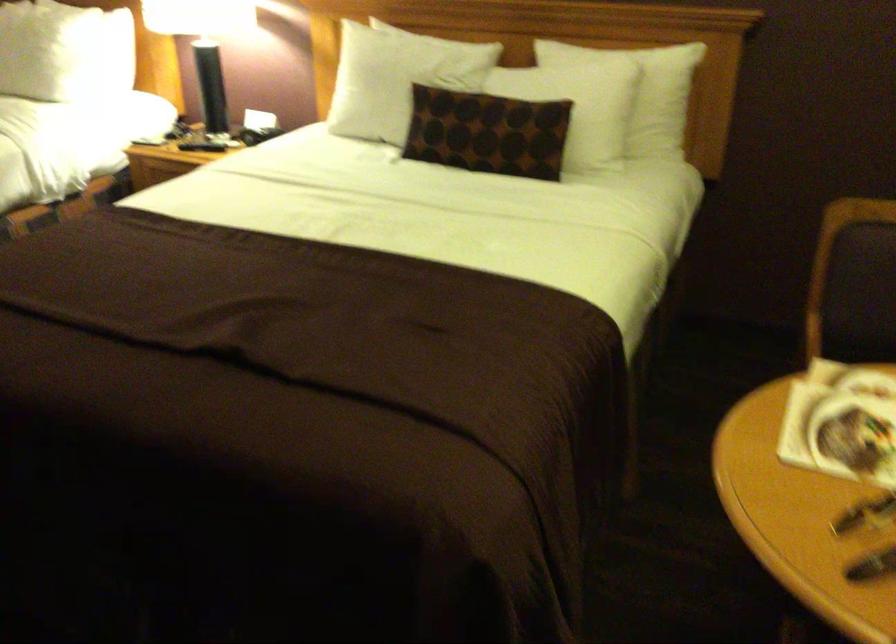
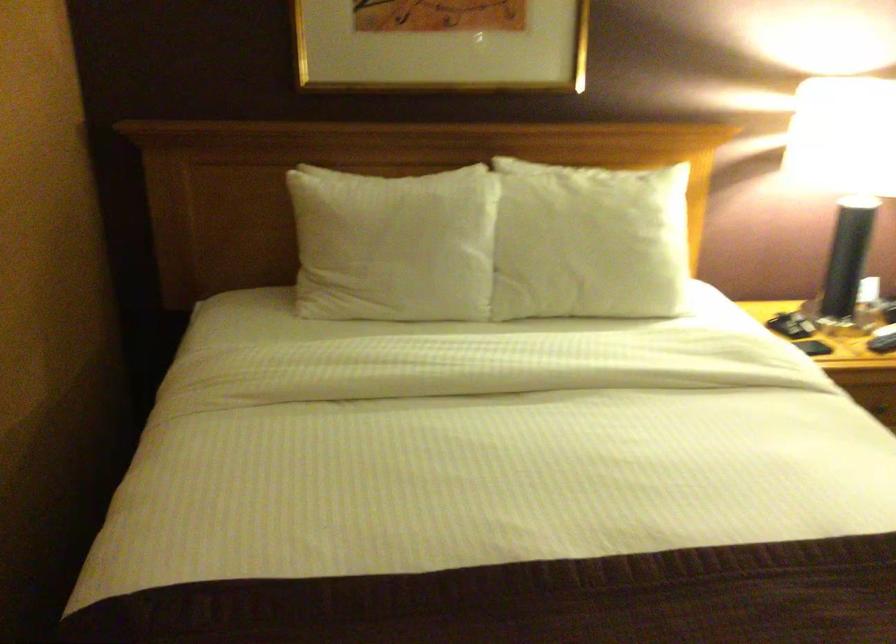
Where in the second image is the point corresponding to the point at 173,129 from the first image?

(782, 325)